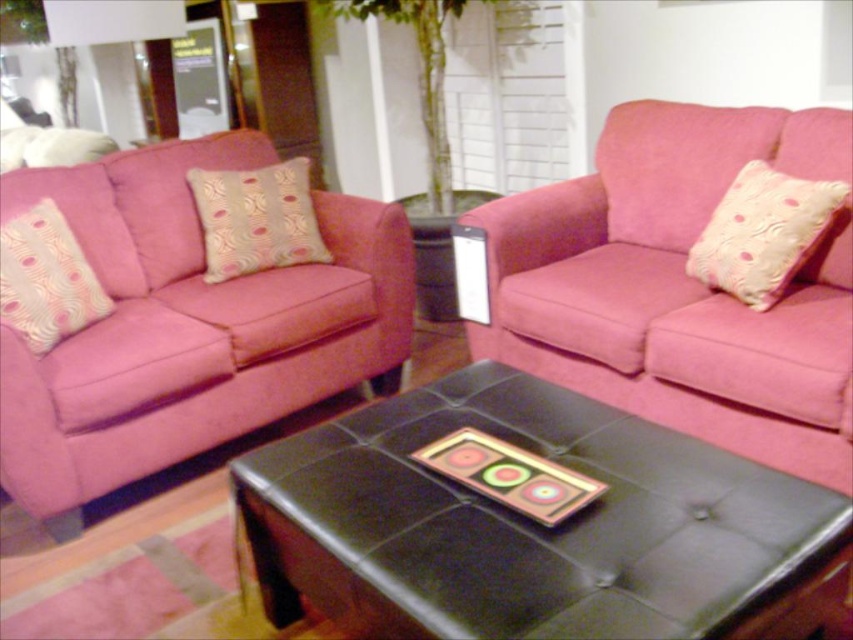
You are standing in the living room and want to place a small potted plant on the floor near the black leather ottoman at center. Based on the coordinates provided, can you determine if the point marked at (532, 525) is the correct location for placing the plant?

The point marked at (532, 525) corresponds to the location of the black leather ottoman at center, so placing the plant near this point would position it close to the ottoman.

You are standing at the origin of the coordinate system in the living room. You see two points marked in the scene. Which point is closer to you, point (264, 204) or point (45, 212)?

Point (45, 212) is closer to you because the description states that point (264, 204) is behind point (45, 212).

From the picture: You are standing in the living room and want to determine which of the two points, point (352, 540) or point (454, 316), is closer to you. Which point is nearer?

Point (352, 540) is closer to the camera than point (454, 316), so it is nearer to you.